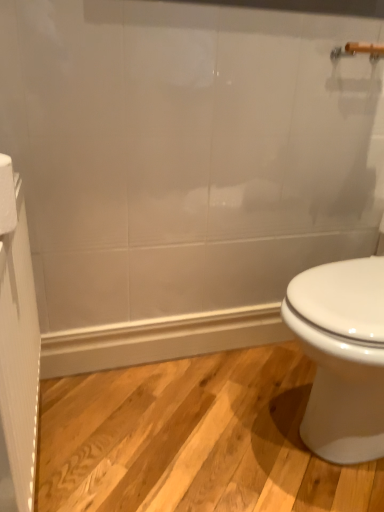
Question: Is white paper towel at left oriented towards white textured screen door at left?

Choices:
 (A) yes
 (B) no

Answer: (B)

Question: Considering the relative sizes of white paper towel at left and white textured screen door at left in the image provided, is white paper towel at left thinner than white textured screen door at left?

Choices:
 (A) no
 (B) yes

Answer: (A)

Question: Is white paper towel at left completely or partially outside of white textured screen door at left?

Choices:
 (A) yes
 (B) no

Answer: (A)

Question: Does white paper towel at left come in front of white textured screen door at left?

Choices:
 (A) yes
 (B) no

Answer: (B)

Question: From the image's perspective, is white paper towel at left located beneath white textured screen door at left?

Choices:
 (A) yes
 (B) no

Answer: (B)

Question: Considering the relative positions of white paper towel at left and white textured screen door at left in the image provided, is white paper towel at left to the left of white textured screen door at left from the viewer's perspective?

Choices:
 (A) yes
 (B) no

Answer: (B)

Question: Considering the relative sizes of white textured screen door at left and white paper towel at left in the image provided, is white textured screen door at left wider than white paper towel at left?

Choices:
 (A) no
 (B) yes

Answer: (A)

Question: From the image's perspective, does white textured screen door at left appear lower than white paper towel at left?

Choices:
 (A) yes
 (B) no

Answer: (A)

Question: Does white textured screen door at left come in front of white paper towel at left?

Choices:
 (A) no
 (B) yes

Answer: (B)

Question: From the image's perspective, is white textured screen door at left located above white paper towel at left?

Choices:
 (A) no
 (B) yes

Answer: (A)

Question: Does white textured screen door at left turn towards white paper towel at left?

Choices:
 (A) yes
 (B) no

Answer: (B)

Question: Is white textured screen door at left oriented away from white paper towel at left?

Choices:
 (A) yes
 (B) no

Answer: (B)

Question: Considering the positions of point (23, 437) and point (3, 185), is point (23, 437) closer or farther from the camera than point (3, 185)?

Choices:
 (A) farther
 (B) closer

Answer: (A)